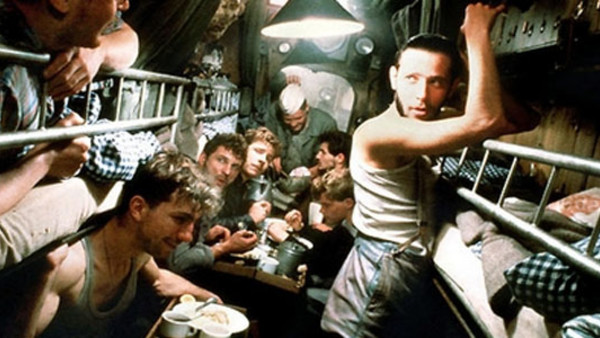
This screenshot has width=600, height=338. Identify the location of bunk. (486, 205).